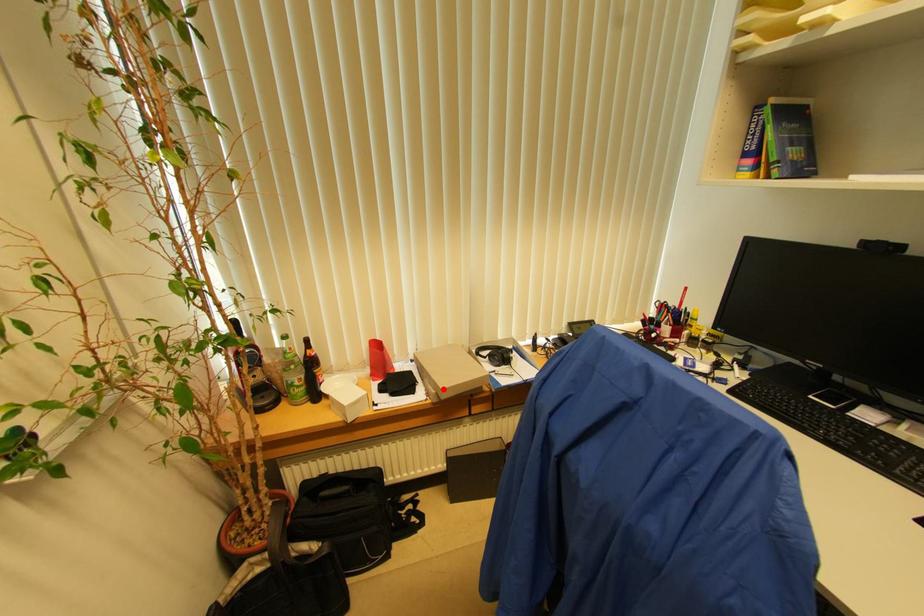
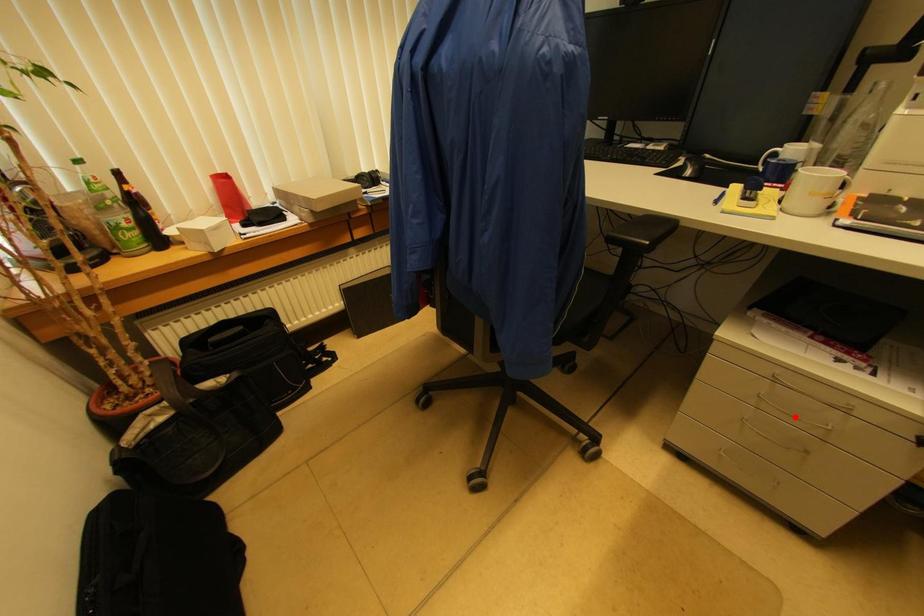
I am providing you with two images of the same scene from different viewpoints. A red point is marked on the first image and another point is marked on the second image. Does the point marked in image1 correspond to the same location as the one in image2?

No